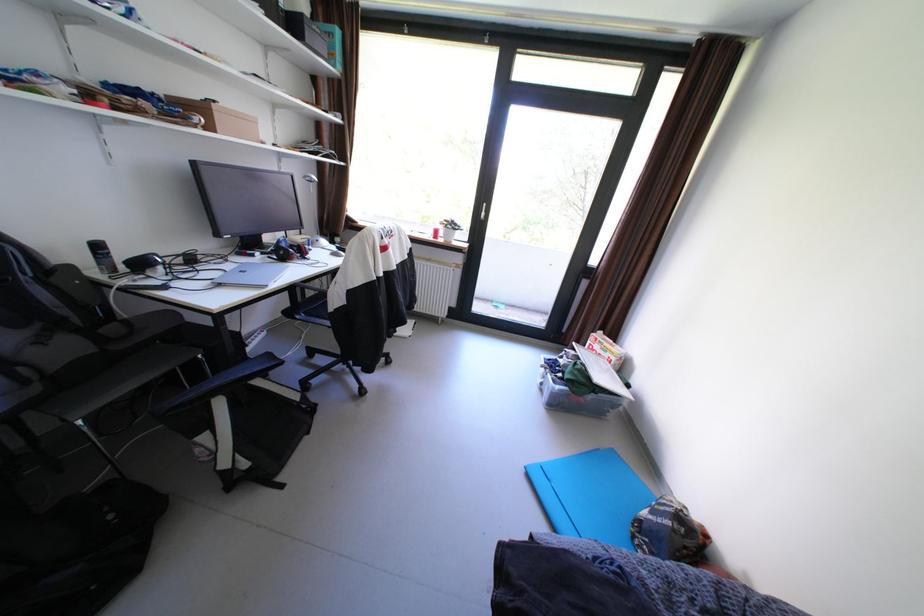
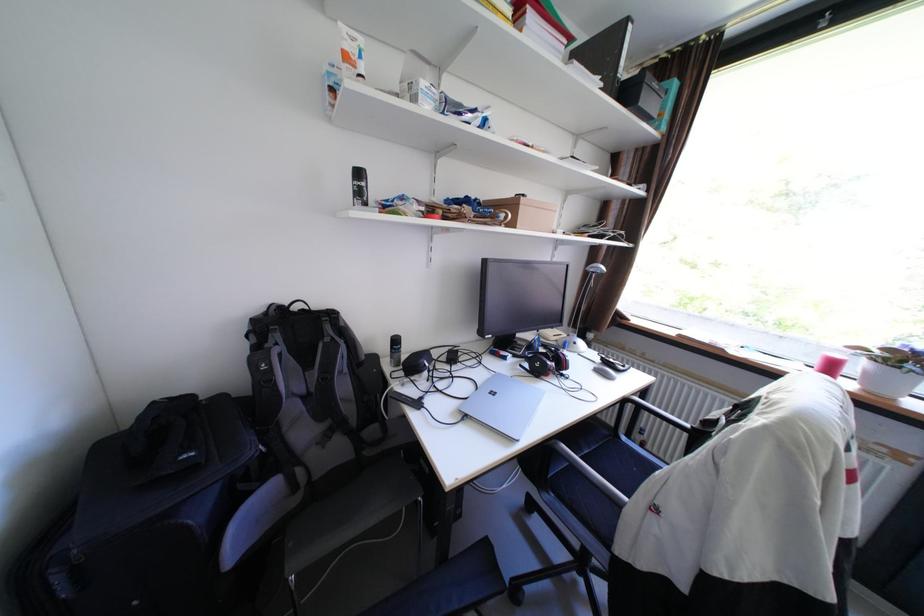
Question: The camera is either moving clockwise (left) or counter-clockwise (right) around the object. The first image is from the beginning of the video and the second image is from the end. Is the camera moving left or right when shooting the video?

Choices:
 (A) Left
 (B) Right

Answer: (B)